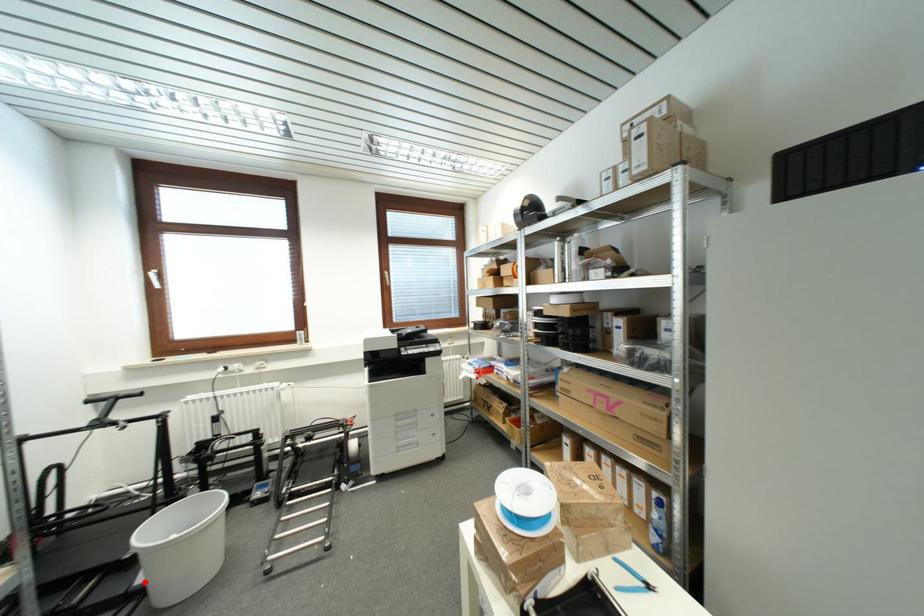
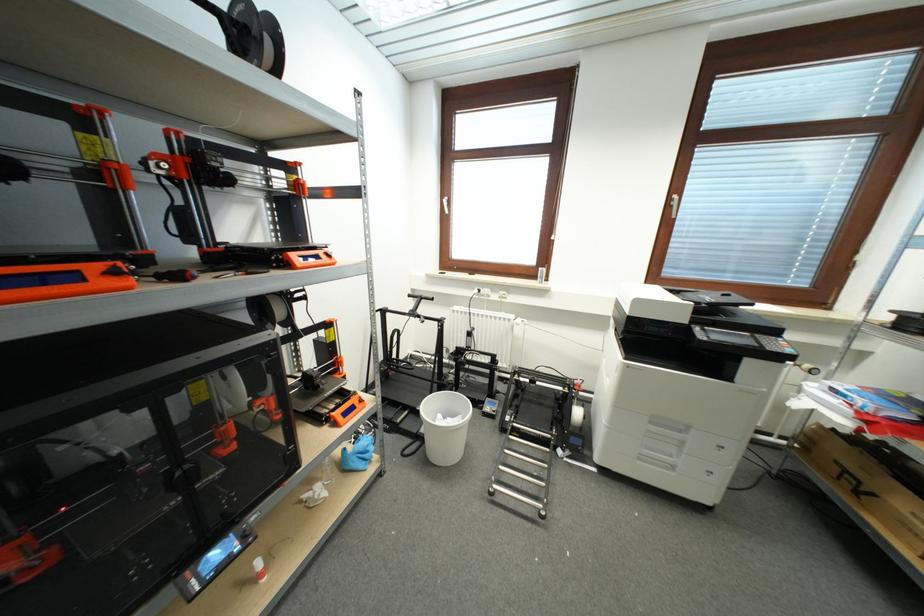
Question: I am providing you with two images of the same scene from different viewpoints. A red point is shown in image1. For the corresponding object point in image2, is it positioned nearer or farther from the camera?

Choices:
 (A) Nearer
 (B) Farther

Answer: (B)